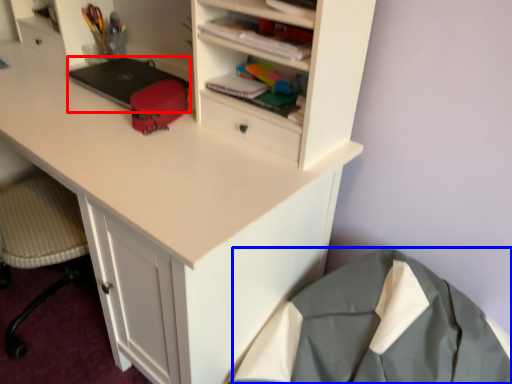
Question: Which object appears farthest to the camera in this image, laptop (highlighted by a red box) or clothing (highlighted by a blue box)?

Choices:
 (A) laptop
 (B) clothing

Answer: (A)